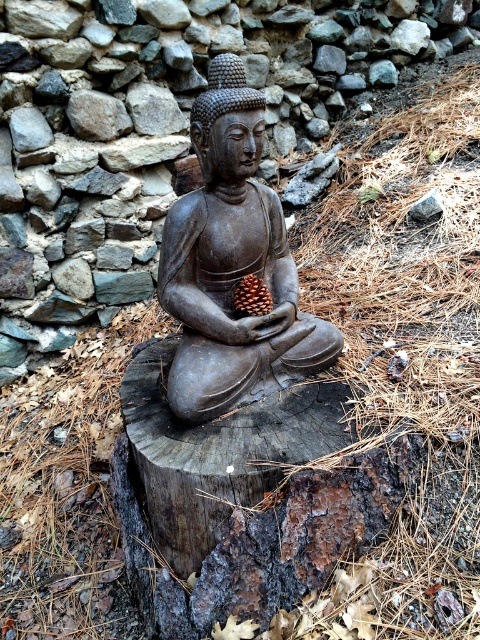
Question: Estimate the real-world distances between objects in this image. Which object is farther from the brown matte pine cone at center?

Choices:
 (A) matte brown statue at center
 (B) matte gray statue at center

Answer: (B)

Question: Is matte brown statue at center positioned before brown matte pine cone at center?

Choices:
 (A) yes
 (B) no

Answer: (A)

Question: Where is matte gray statue at center located in relation to brown matte pine cone at center in the image?

Choices:
 (A) right
 (B) left

Answer: (A)

Question: Which point appears farthest from the camera in this image?

Choices:
 (A) (108, 211)
 (B) (264, 284)
 (C) (211, 305)

Answer: (A)

Question: Which point appears closest to the camera in this image?

Choices:
 (A) (276, 269)
 (B) (284, 145)

Answer: (A)

Question: Does matte gray statue at center appear on the left side of brown matte pine cone at center?

Choices:
 (A) no
 (B) yes

Answer: (A)